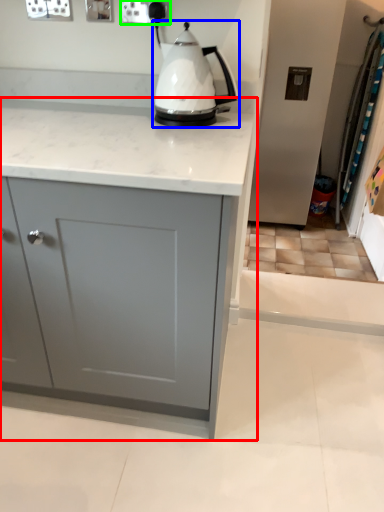
Question: Estimate the real-world distances between objects in this image. Which object is farther from cabinetry (highlighted by a red box), kettle (highlighted by a blue box) or electric outlet (highlighted by a green box)?

Choices:
 (A) kettle
 (B) electric outlet

Answer: (B)